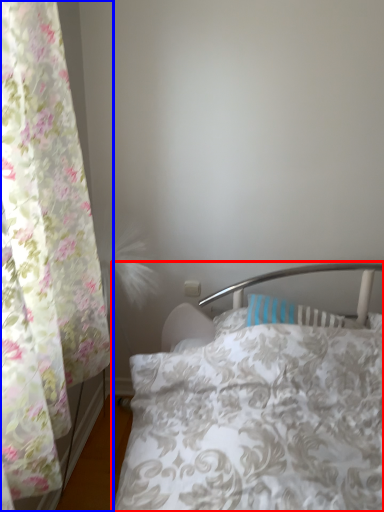
Question: Which of the following is the closest to the observer, bed (highlighted by a red box) or curtain (highlighted by a blue box)?

Choices:
 (A) bed
 (B) curtain

Answer: (B)